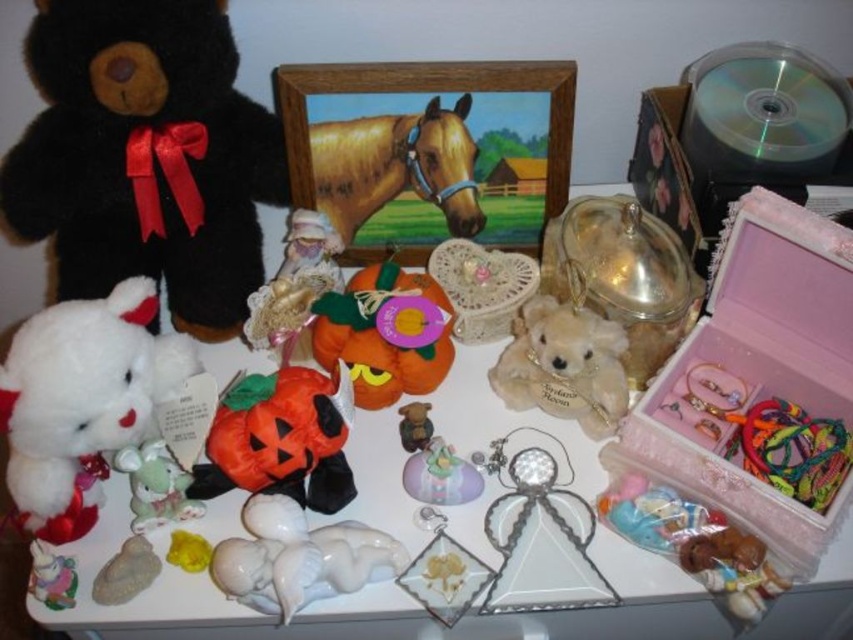
Question: Based on their relative distances, which object is farther from the matte gold bear at center?

Choices:
 (A) white plush bear at lower left
 (B) black plush bear at left
 (C) golden glossy horse at upper center

Answer: (B)

Question: Can you confirm if orange fabric pumpkin at center is positioned below porcelain mouse at lower left?

Choices:
 (A) no
 (B) yes

Answer: (A)

Question: Is the position of orange plush pumpkin at center more distant than that of golden glossy horse at upper center?

Choices:
 (A) yes
 (B) no

Answer: (B)

Question: Is golden glossy horse at upper center bigger than white glossy cherub at center?

Choices:
 (A) yes
 (B) no

Answer: (A)

Question: Estimate the real-world distances between objects in this image. Which object is closer to the white plush bear at upper left?

Choices:
 (A) matte ceramic figurine at center
 (B) black plush bear at left
 (C) golden glossy horse at upper center
 (D) white glossy cherub at center

Answer: (D)

Question: Which of the following is the farthest from the observer?

Choices:
 (A) pink fabric jewelry box at right
 (B) golden glossy horse at upper center
 (C) matte gold bear at center

Answer: (B)